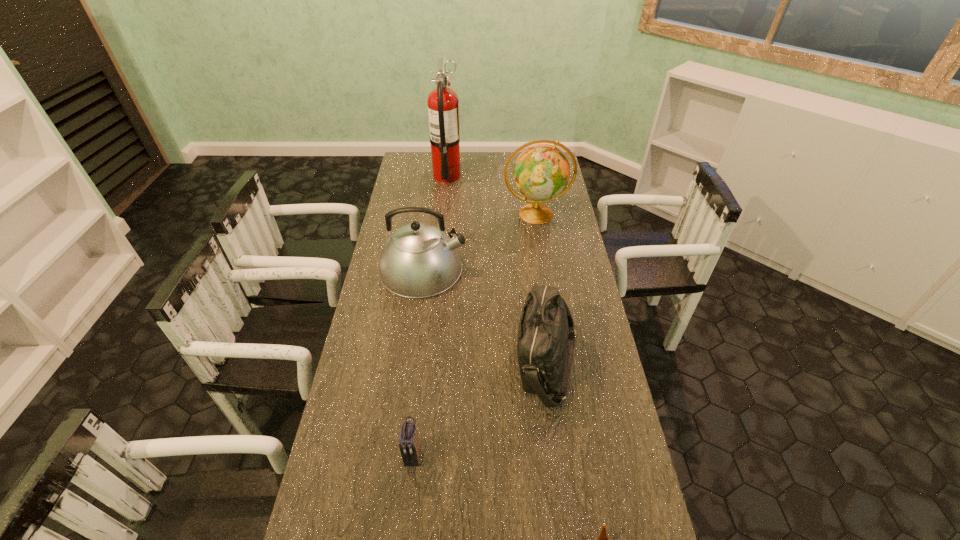
Choose which object is the fifth nearest neighbor to the globe. Please provide its 2D coordinates. Your answer should be formatted as a tuple, i.e. [(x, y)], where the tuple contains the x and y coordinates of a point satisfying the conditions above.

[(602, 539)]

The image size is (960, 540). What are the coordinates of `free space that satisfies the following two spatial constraints: 1. on the nozzle side of the tallest object; 2. with the zip open on the second nearest object` in the screenshot? It's located at (419, 455).

I want to click on free space that satisfies the following two spatial constraints: 1. at the front padded panel of the shoulder bag; 2. with the zip open on the second shortest object, so click(x=559, y=455).

Image resolution: width=960 pixels, height=540 pixels. In order to click on free space in the image that satisfies the following two spatial constraints: 1. on the back side of the fifth shortest object; 2. on the nozzle side of the tallest object in this screenshot , I will do `click(530, 176)`.